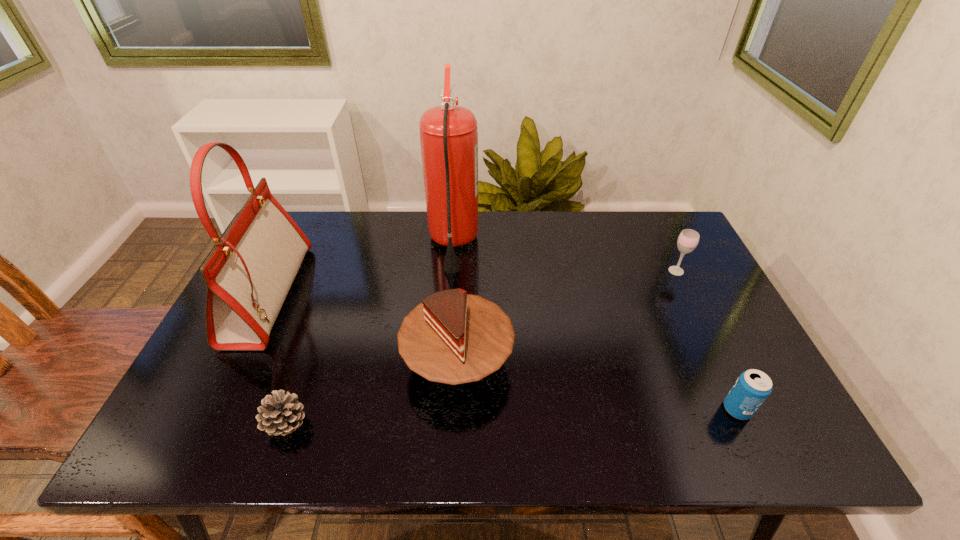
This screenshot has width=960, height=540. What are the coordinates of `fire extinguisher` in the screenshot? It's located at (448, 133).

Locate an element on the screen. The width and height of the screenshot is (960, 540). the leftmost object is located at coordinates (248, 274).

Find the location of `cake`. cake is located at coordinates (452, 337).

In order to click on wineglass in this screenshot , I will do `click(688, 239)`.

Where is `the fifth tallest object`? This screenshot has width=960, height=540. the fifth tallest object is located at coordinates (x=752, y=388).

At what (x,y) coordinates should I click in order to perform the action: click on pinecone. Please return your answer as a coordinate pair (x, y). Looking at the image, I should click on [280, 415].

Locate an element on the screen. the shortest object is located at coordinates (280, 415).

Locate an element on the screen. The height and width of the screenshot is (540, 960). free space located 0.110m on the instruction side of the fire extinguisher is located at coordinates (513, 244).

Image resolution: width=960 pixels, height=540 pixels. I want to click on vacant region located on the front of the leftmost object, so click(211, 414).

This screenshot has height=540, width=960. I want to click on vacant area located on the right of the third tallest object, so click(x=574, y=361).